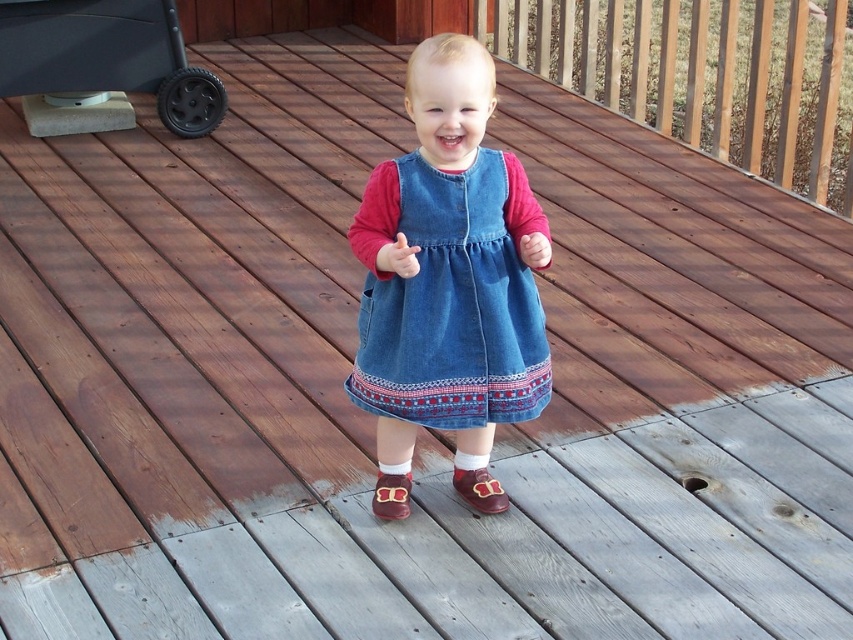
Does black rubber baby carriage at upper left appear over brown suede shoe at center?

Indeed, black rubber baby carriage at upper left is positioned over brown suede shoe at center.

Where is `black rubber baby carriage at upper left`? This screenshot has height=640, width=853. black rubber baby carriage at upper left is located at coordinates (107, 56).

Does denim dress at center have a smaller size compared to black rubber baby carriage at upper left?

Yes.

Is denim dress at center thinner than black rubber baby carriage at upper left?

Indeed, denim dress at center has a lesser width compared to black rubber baby carriage at upper left.

Who is more distant from viewer, (450,397) or (163,35)?

Point (163,35)

Locate an element on the screen. The image size is (853, 640). denim dress at center is located at coordinates (450, 296).

Which of these two, denim dress at center or brown suede shoe at center, stands taller?

Standing taller between the two is denim dress at center.

Which is above, denim dress at center or brown suede shoe at center?

denim dress at center is above.

Is point (351, 390) farther from camera compared to point (401, 508)?

No.

In order to click on denim dress at center in this screenshot , I will do `click(450, 296)`.